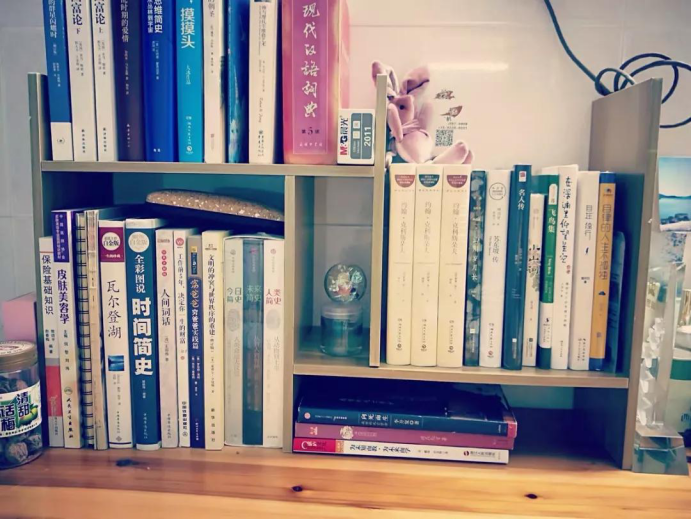
Where is `book on top shelf`? Image resolution: width=692 pixels, height=519 pixels. book on top shelf is located at coordinates (55, 74), (75, 77), (100, 83), (127, 98), (151, 101), (182, 77), (212, 87), (233, 98), (260, 102), (304, 104).